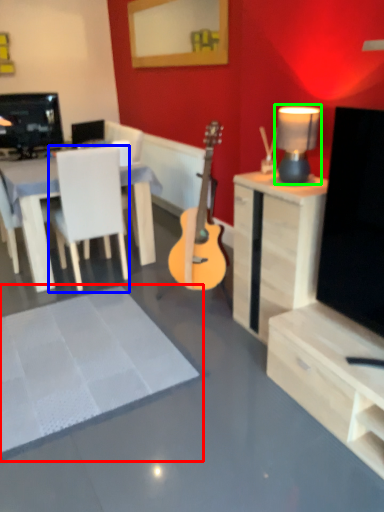
Question: Which is farther away from flat (highlighted by a red box)? chair (highlighted by a blue box) or lamp (highlighted by a green box)?

Choices:
 (A) chair
 (B) lamp

Answer: (B)